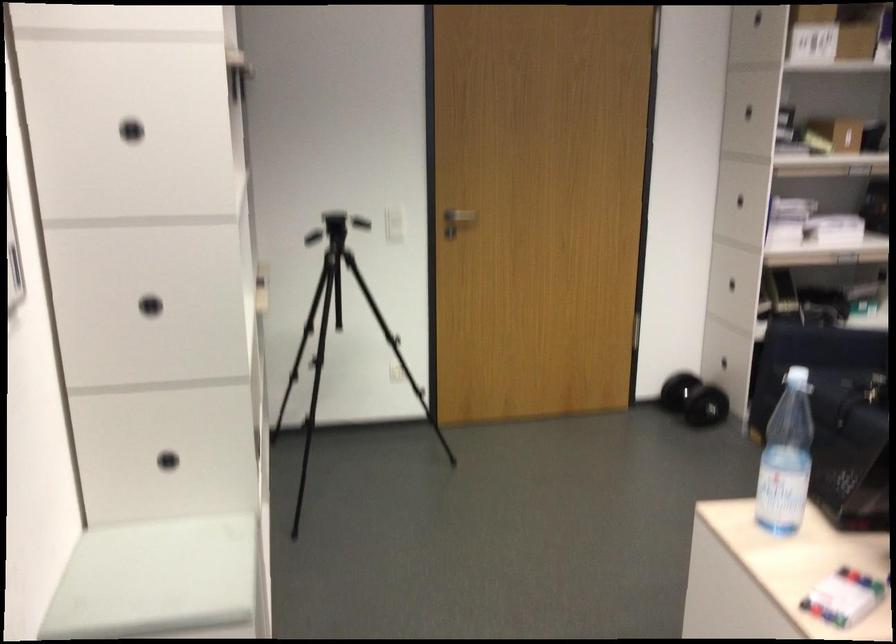
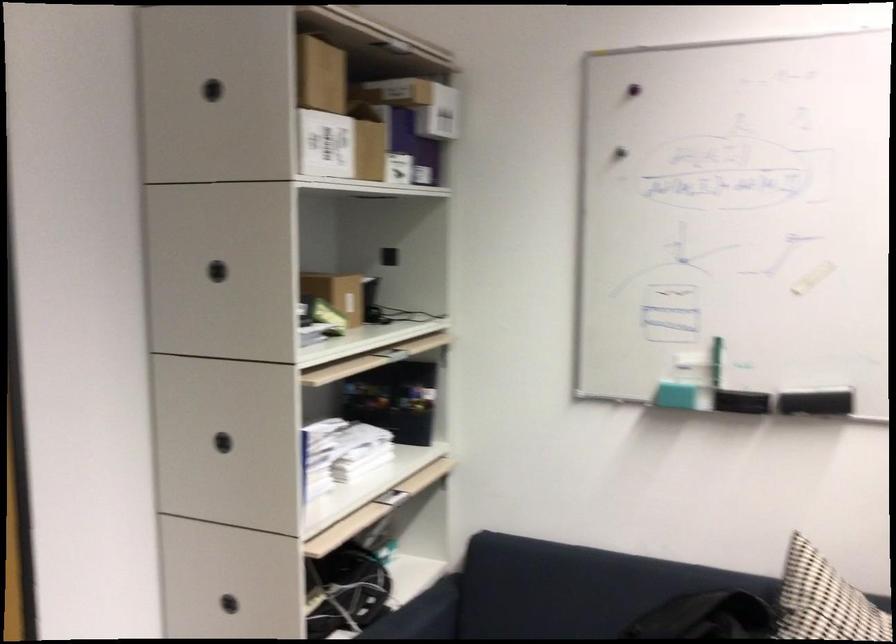
The point at (729, 207) is marked in the first image. Where is the corresponding point in the second image?

(222, 442)